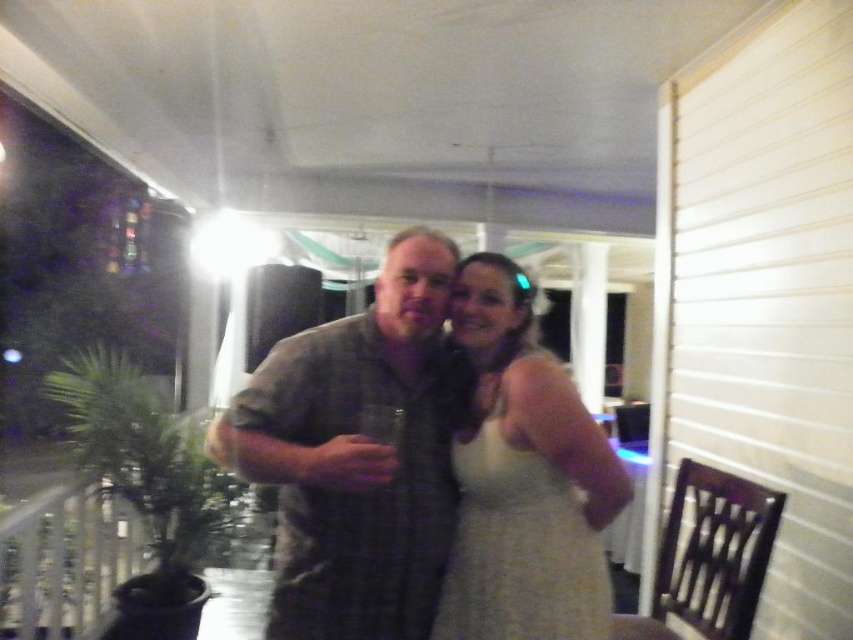
You are a photographer trying to capture a closeup shot of both the gray plaid shirt at center and the white satin dress at center. Since you can only focus on one subject at a time, which one should you choose to ensure the other remains in the background?

The gray plaid shirt at center is positioned on the left side of white satin dress at center, so focusing on the gray plaid shirt at center would place the white satin dress at center in the background.

You are a photographer setting up a shot for two people. The scene requires them to stand side by side on a porch. The gray plaid shirt at center and white satin dress at center must be visible. Given their positions, which clothing item is wider?

The gray plaid shirt at center might be wider than white satin dress at center.